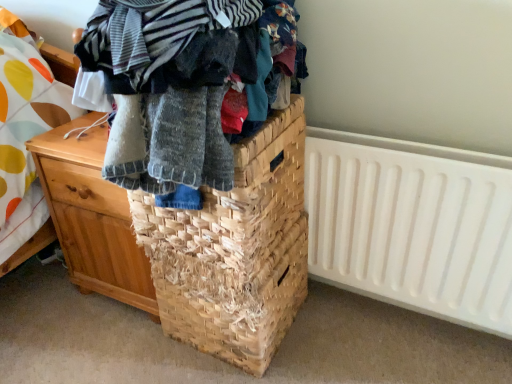
Question: Is natural fiber basket at center taller than white plastic radiator at right?

Choices:
 (A) yes
 (B) no

Answer: (B)

Question: Does natural fiber basket at center touch white plastic radiator at right?

Choices:
 (A) no
 (B) yes

Answer: (A)

Question: Is natural fiber basket at center aimed at white plastic radiator at right?

Choices:
 (A) no
 (B) yes

Answer: (A)

Question: Is natural fiber basket at center not inside white plastic radiator at right?

Choices:
 (A) no
 (B) yes

Answer: (B)

Question: From the image's perspective, is natural fiber basket at center under white plastic radiator at right?

Choices:
 (A) no
 (B) yes

Answer: (B)

Question: Is point (381, 294) positioned closer to the camera than point (117, 61)?

Choices:
 (A) farther
 (B) closer

Answer: (A)

Question: From the image's perspective, relative to knitted wool sweater at center, is white plastic radiator at right above or below?

Choices:
 (A) above
 (B) below

Answer: (B)

Question: Would you say white plastic radiator at right is to the left or to the right of knitted wool sweater at center in the picture?

Choices:
 (A) left
 (B) right

Answer: (B)

Question: From their relative heights in the image, would you say white plastic radiator at right is taller or shorter than knitted wool sweater at center?

Choices:
 (A) tall
 (B) short

Answer: (A)

Question: Based on their positions, is knitted wool sweater at center located to the left or right of white plastic radiator at right?

Choices:
 (A) right
 (B) left

Answer: (B)

Question: In terms of width, does knitted wool sweater at center look wider or thinner when compared to white plastic radiator at right?

Choices:
 (A) wide
 (B) thin

Answer: (A)

Question: From the image's perspective, is knitted wool sweater at center positioned above or below white plastic radiator at right?

Choices:
 (A) above
 (B) below

Answer: (A)

Question: Which is correct: knitted wool sweater at center is inside white plastic radiator at right, or outside of it?

Choices:
 (A) outside
 (B) inside

Answer: (A)

Question: In terms of height, does wooden chest of drawers at left look taller or shorter compared to knitted wool sweater at center?

Choices:
 (A) tall
 (B) short

Answer: (A)

Question: Is wooden chest of drawers at left wider or thinner than knitted wool sweater at center?

Choices:
 (A) thin
 (B) wide

Answer: (A)